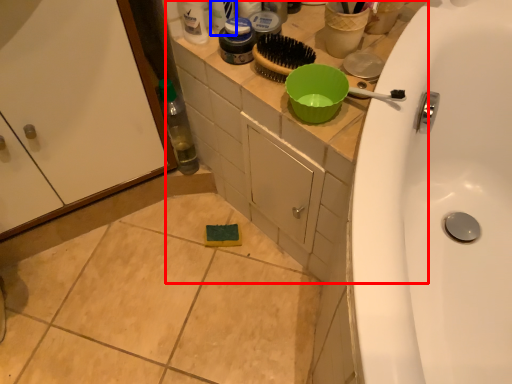
Question: Which point is further to the camera, counter top (highlighted by a red box) or toiletry (highlighted by a blue box)?

Choices:
 (A) counter top
 (B) toiletry

Answer: (B)